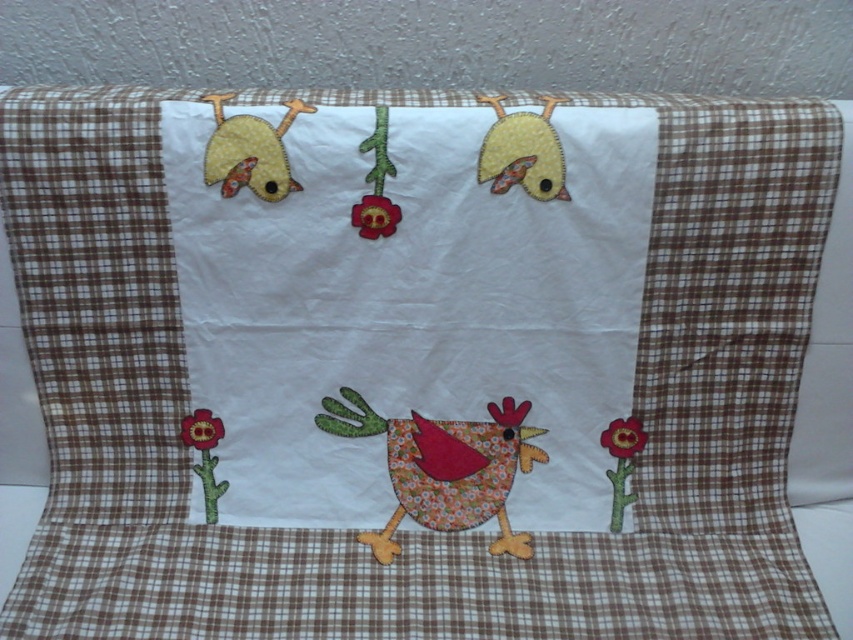
Between matte yellow chicken at upper left and floral fabric flower at lower left, which one is positioned higher?

matte yellow chicken at upper left

Which is more to the left, matte yellow chicken at upper left or floral fabric flower at lower left?

floral fabric flower at lower left is more to the left.

Where is `matte yellow chicken at upper left`? matte yellow chicken at upper left is located at coordinates (250, 150).

Can you confirm if floral fabric chicken at lower center is positioned to the right of matte yellow chicken at upper left?

Correct, you'll find floral fabric chicken at lower center to the right of matte yellow chicken at upper left.

Is floral fabric chicken at lower center above matte yellow chicken at upper left?

Incorrect, floral fabric chicken at lower center is not positioned above matte yellow chicken at upper left.

Between point (345, 420) and point (221, 100), which one is positioned in front?

Point (221, 100)

Locate an element on the screen. The image size is (853, 640). floral fabric chicken at lower center is located at coordinates (444, 467).

Between point (223, 148) and point (381, 113), which one is positioned behind?

The point (223, 148) is behind.

Can you confirm if matte yellow chicken at upper left is positioned above matte fabric flower at center?

Yes.

The image size is (853, 640). Describe the element at coordinates (250, 150) in the screenshot. I see `matte yellow chicken at upper left` at that location.

Locate an element on the screen. This screenshot has height=640, width=853. matte yellow chicken at upper left is located at coordinates (250, 150).